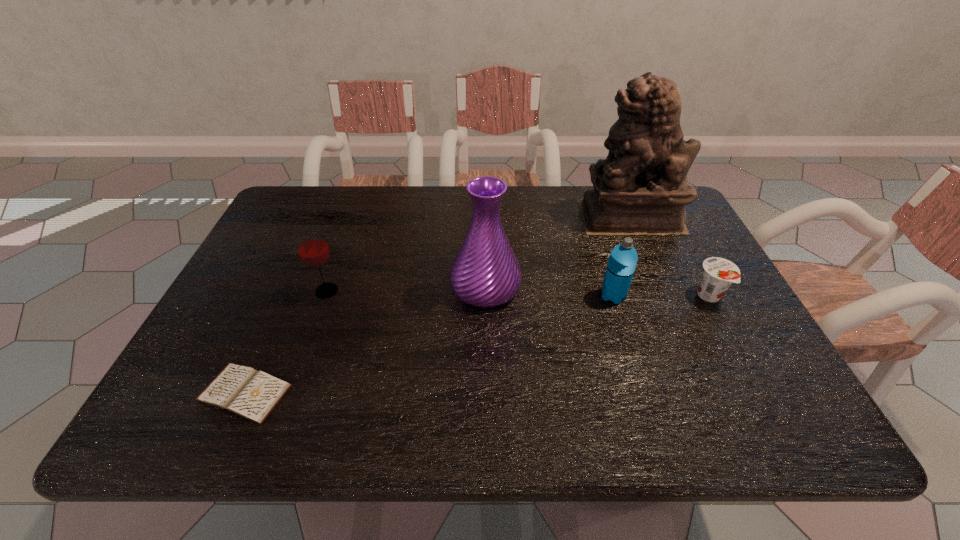
Find the location of a particular element. vacant space that is in between the thermos bottle and the shortest object is located at coordinates (429, 344).

Where is `vacant area that lies between the thermos bottle and the nearest object`? The width and height of the screenshot is (960, 540). vacant area that lies between the thermos bottle and the nearest object is located at coordinates (429, 344).

What are the coordinates of `empty location between the fifth shortest object and the farthest object` in the screenshot? It's located at (558, 252).

Where is `vacant point located between the sculpture and the yogurt`? vacant point located between the sculpture and the yogurt is located at coordinates (670, 256).

I want to click on unoccupied area between the thermos bottle and the shortest object, so click(429, 344).

Where is `unoccupied area between the third object from left to right and the yogurt`? This screenshot has width=960, height=540. unoccupied area between the third object from left to right and the yogurt is located at coordinates (597, 292).

Where is `blank region between the vase and the yogurt`? blank region between the vase and the yogurt is located at coordinates (597, 292).

Identify which object is the fourth closest to the thermos bottle. Please provide its 2D coordinates. Your answer should be formatted as a tuple, i.e. [(x, y)], where the tuple contains the x and y coordinates of a point satisfying the conditions above.

[(313, 250)]

This screenshot has width=960, height=540. What are the coordinates of `object that stands as the third closest to the glass` in the screenshot? It's located at (621, 265).

At what (x,y) coordinates should I click in order to perform the action: click on free space that satisfies the following two spatial constraints: 1. on the front-facing side of the sculpture; 2. on the front side of the shortest object. Please return your answer as a coordinate pair (x, y). This screenshot has width=960, height=540. Looking at the image, I should click on (706, 393).